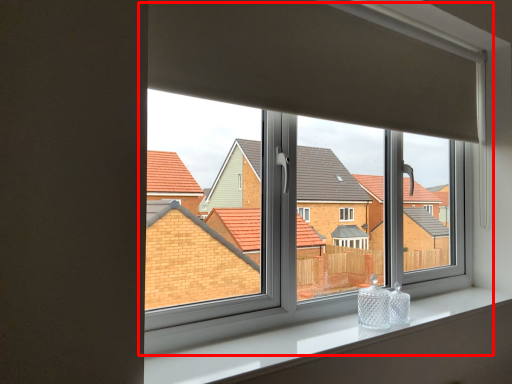
Question: From the image's perspective, what is the correct spatial relationship of window (annotated by the red box) in relation to window sill?

Choices:
 (A) below
 (B) above

Answer: (B)